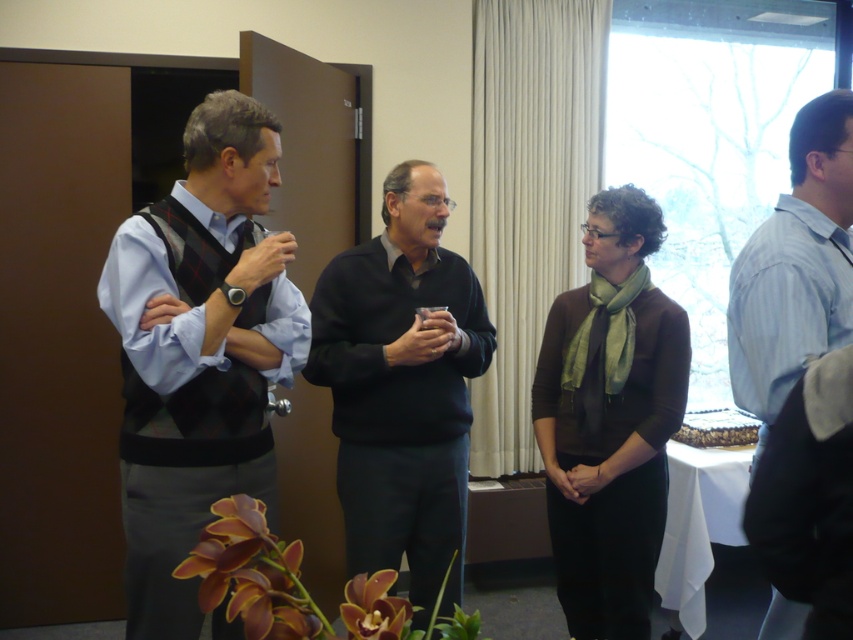
You are a photographer standing in the conference room. You need to take a group photo of the matte black vest at left and the light blue shirt at right. The camera you are using has a minimum focus distance of 1 meter. Will you be able to capture both subjects clearly in the same frame?

The matte black vest at left and light blue shirt at right are 1.14 meters apart, which is beyond the camera minimum focus distance of 1 meter. Therefore, you can capture both subjects clearly in the same frame.

Consider the image. You are organizing a charity event and need to decide which of the two items, the matte black vest at left or the dark gray sweater at center, would be more suitable for a compact storage space. Based on their sizes, which one should you choose?

The matte black vest at left is smaller than the dark gray sweater at center, so it would be more suitable for compact storage.